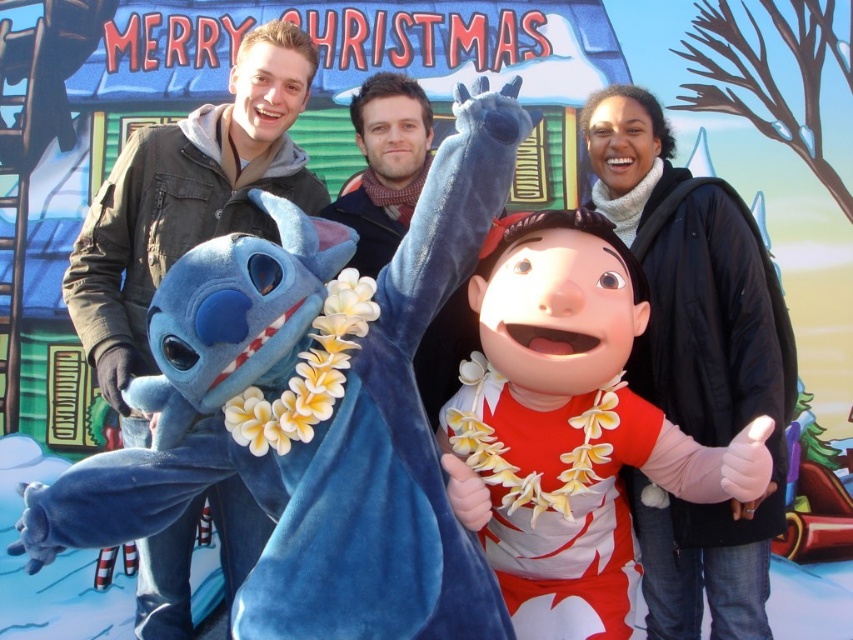
Question: Does matte red dress at center appear over matte black hoodie at left?

Choices:
 (A) no
 (B) yes

Answer: (A)

Question: Observing the image, what is the correct spatial positioning of matte red dress at center in reference to matte black jacket at upper right?

Choices:
 (A) right
 (B) left

Answer: (B)

Question: Considering the real-world distances, which object is farthest from the matte black hoodie at left?

Choices:
 (A) matte black jacket at upper right
 (B) matte red dress at center

Answer: (A)

Question: Can you confirm if matte red dress at center is positioned to the right of matte black hoodie at left?

Choices:
 (A) yes
 (B) no

Answer: (A)

Question: Which of these objects is positioned closest to the matte red dress at center?

Choices:
 (A) matte black hoodie at left
 (B) matte black jacket at upper right

Answer: (B)

Question: Among these objects, which one is nearest to the camera?

Choices:
 (A) matte black hoodie at left
 (B) matte red dress at center
 (C) matte black jacket at upper right

Answer: (B)